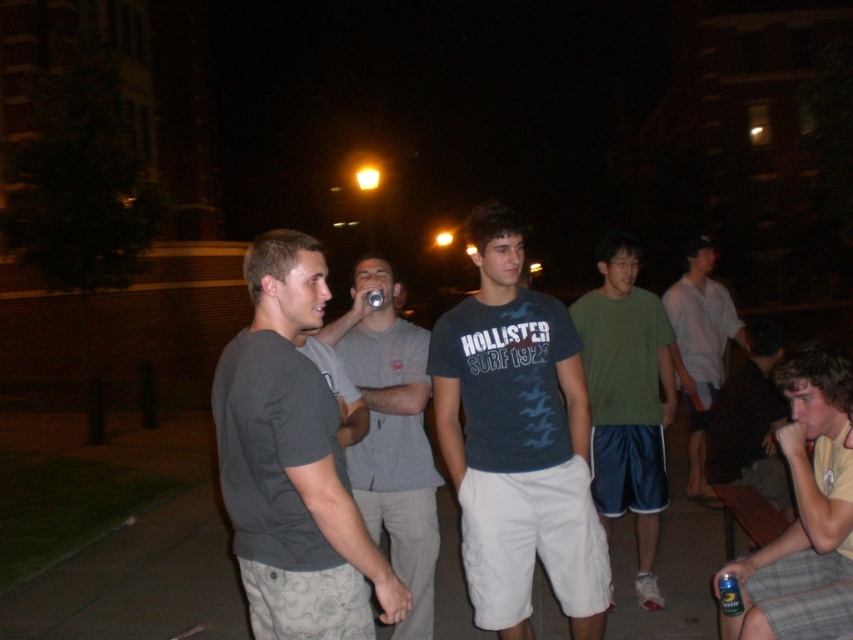
You are a photographer trying to capture a candid shot of the social gathering. You want to ensure both the yellow plaid shorts at lower right and the green fabric shirt at center are in focus. Since the camera can only focus on one subject at a time, which subject should you prioritize focusing on to ensure the other is also in focus due to its position relative to the camera?

You should focus on the green fabric shirt at center because the yellow plaid shorts at lower right is located below it, making them closer to the same focal plane.